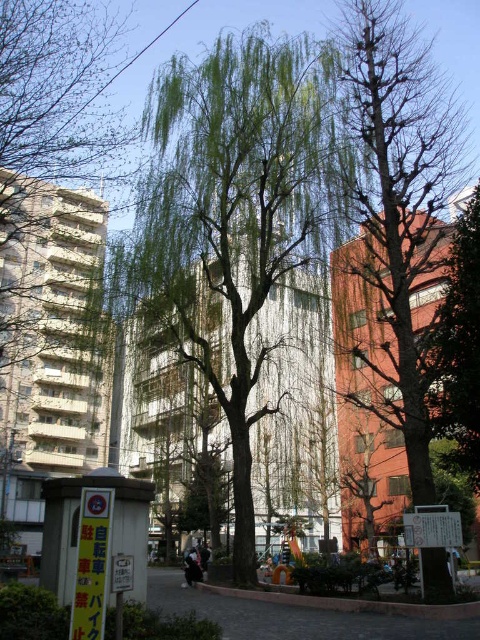
Between point (389, 304) and point (454, 250), which one is positioned in front?

Point (454, 250)

Is bare branches tree at right in front of bare branches at right?

No, it is behind bare branches at right.

Image resolution: width=480 pixels, height=640 pixels. Identify the location of bare branches tree at right. (395, 205).

Does green leafy willow at center have a lesser height compared to bare branches tree at right?

In fact, green leafy willow at center may be taller than bare branches tree at right.

Locate an element on the screen. green leafy willow at center is located at coordinates (231, 220).

Does green leafy willow at center have a lesser width compared to bare branches at right?

No, green leafy willow at center is not thinner than bare branches at right.

Who is positioned more to the left, green leafy willow at center or bare branches at right?

From the viewer's perspective, green leafy willow at center appears more on the left side.

Describe the element at coordinates (231, 220) in the screenshot. I see `green leafy willow at center` at that location.

Identify the location of green leafy willow at center. Image resolution: width=480 pixels, height=640 pixels. (231, 220).